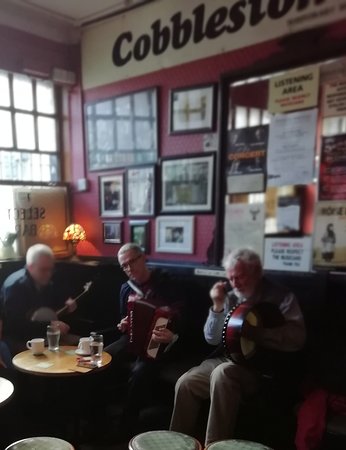
You are a GUI agent. You are given a task and a screenshot of the screen. Output one action in this format:
    pyautogui.click(x=<x>, y=<y>)
    Task: Click on the windows
    
    Given the screenshot: What is the action you would take?
    pyautogui.click(x=37, y=136)